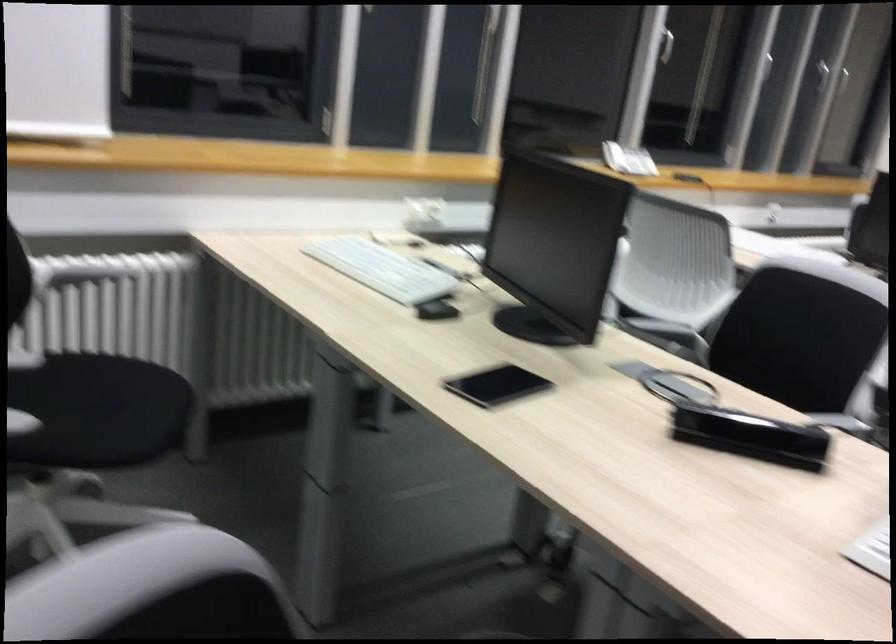
Describe the element at coordinates (435, 297) in the screenshot. I see `the black stapler top` at that location.